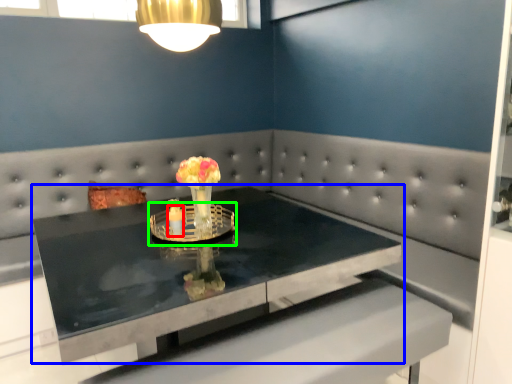
Question: Based on their relative distances, which object is farther from candle holder (highlighted by a red box)? Choose from table (highlighted by a blue box) and candle holder (highlighted by a green box).

Choices:
 (A) table
 (B) candle holder

Answer: (A)